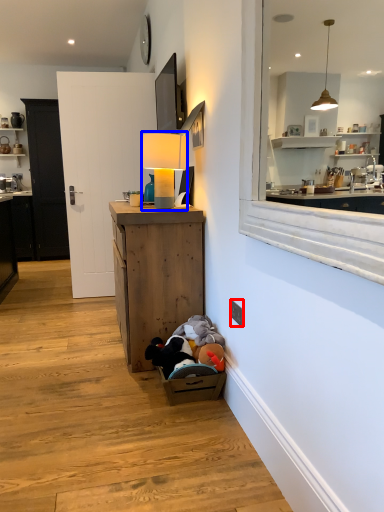
Question: Which point is closer to the camera, electric outlet (highlighted by a red box) or table lamp (highlighted by a blue box)?

Choices:
 (A) electric outlet
 (B) table lamp

Answer: (A)